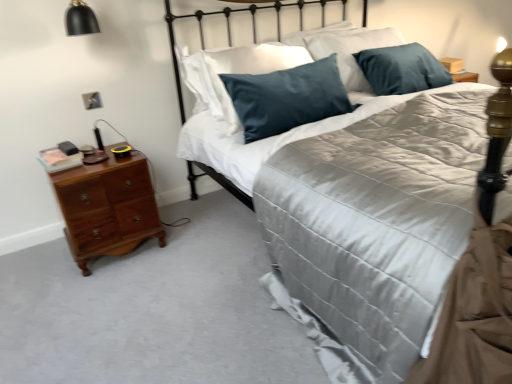
Find the location of a particular element. Image resolution: width=512 pixels, height=384 pixels. vacant area that is situated to the right of cherry wood nightstand at left is located at coordinates (186, 245).